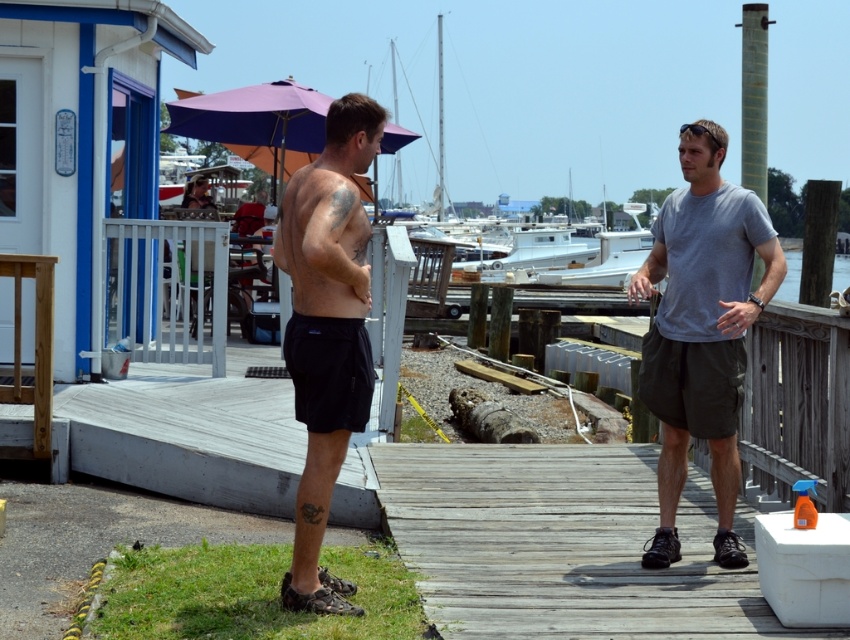
You are navigating a small boat towards the marina and need to dock at the weathered wood dock at center. According to the coordinates provided, is the dock positioned closer to the right or left side of the image?

The weathered wood dock at center is located at point 0.852 on the x and 0.662 on the y, which places it closer to the right side of the image since the x coordinate is closer to 1.0.